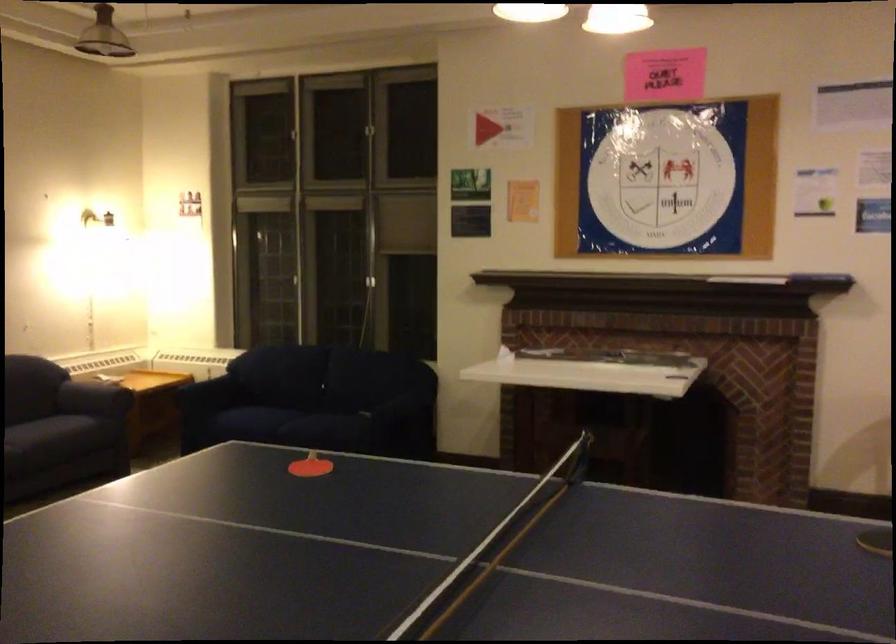
The height and width of the screenshot is (644, 896). I want to click on blue sofa armrest, so click(x=185, y=398).